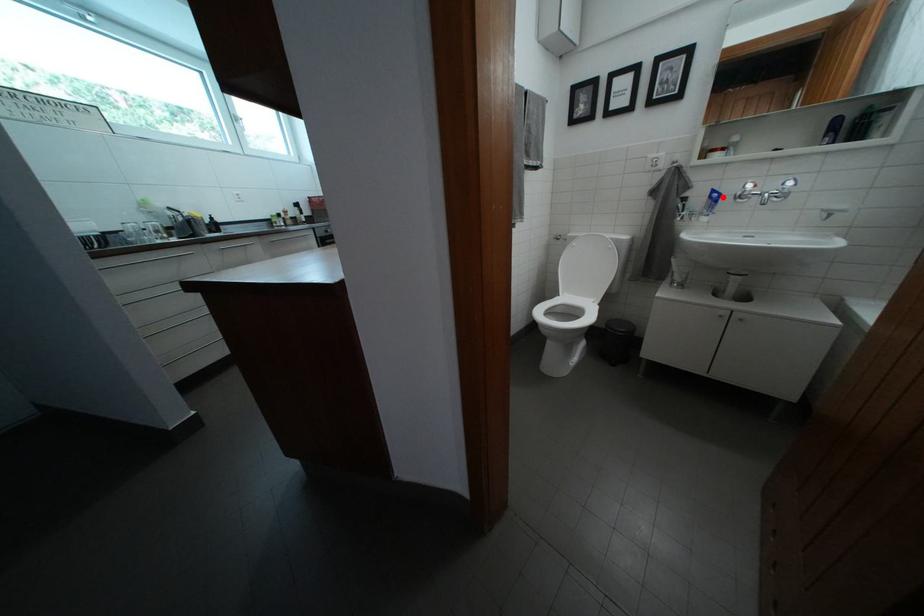
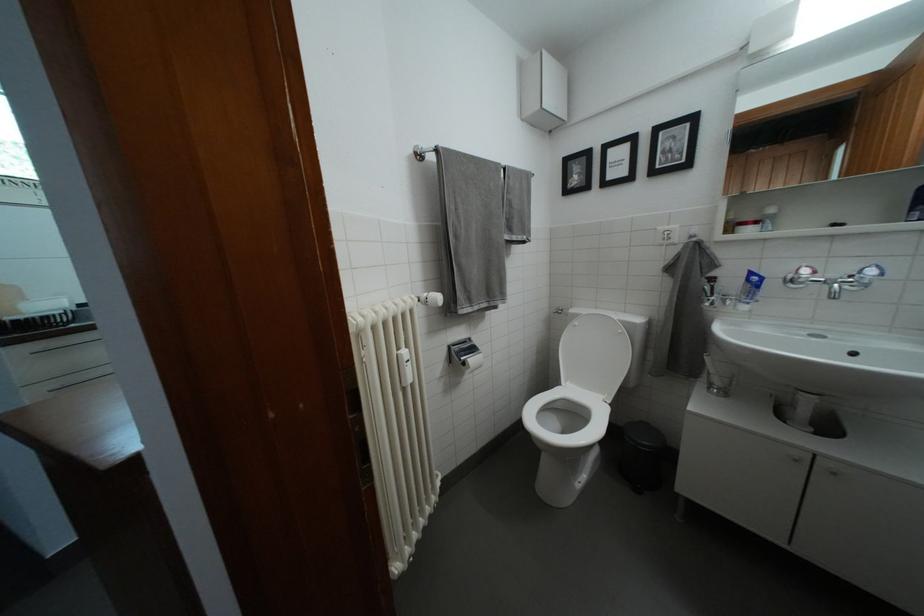
The point at the highlighted location is marked in the first image. Where is the corresponding point in the second image?

(760, 280)